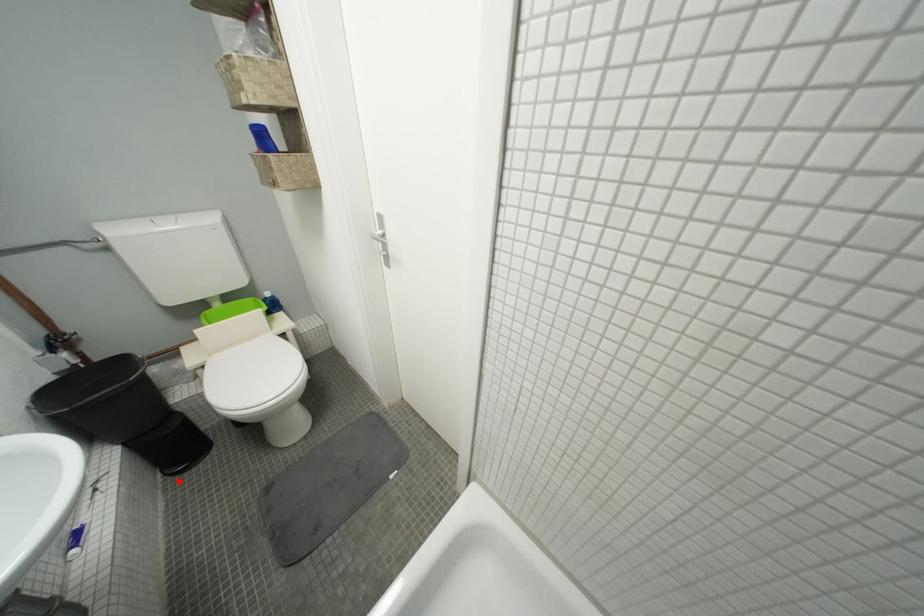
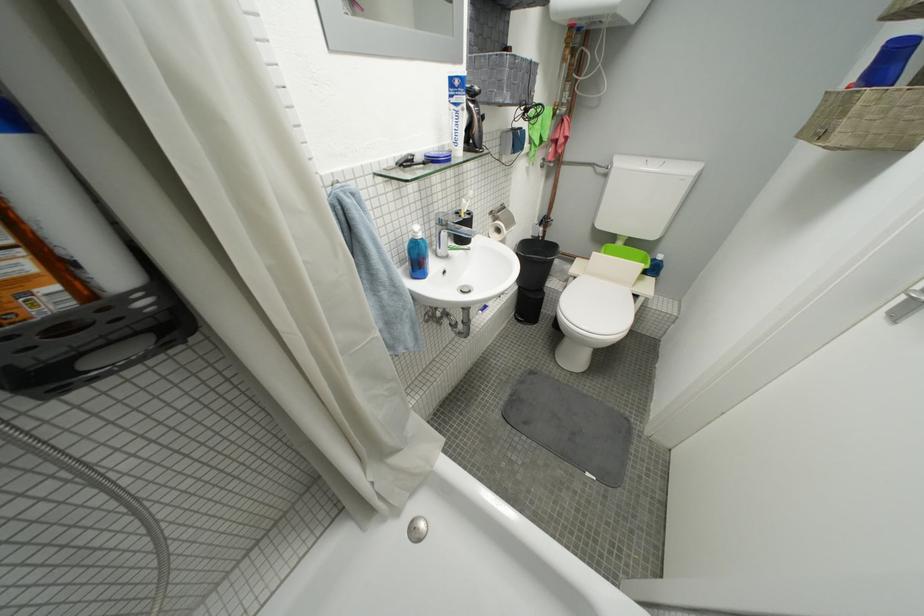
Question: I am providing you with two images of the same scene from different viewpoints. Given a red point in image1, look at the same physical point in image2. Is it:

Choices:
 (A) Closer to the viewpoint
 (B) Farther from the viewpoint

Answer: (B)